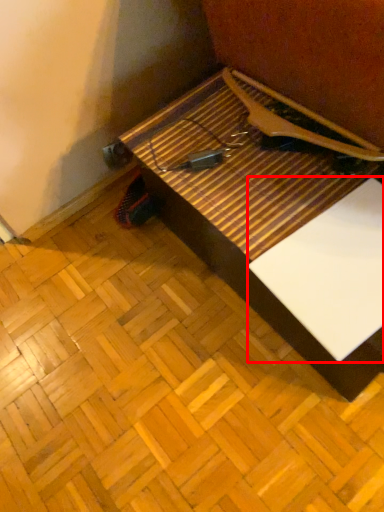
Question: From the image's perspective, what is the correct spatial relationship of wide (annotated by the red box) in relation to table?

Choices:
 (A) above
 (B) below

Answer: (B)